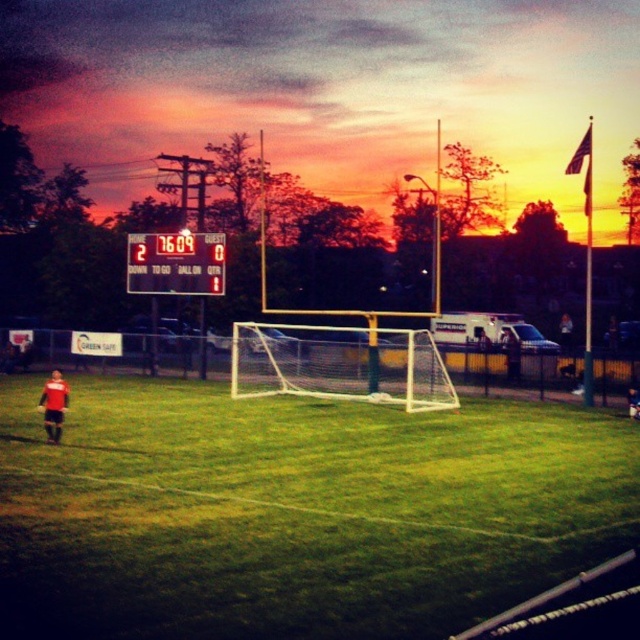
Question: Does black plastic scoreboard at center have a greater width compared to red jersey at lower left?

Choices:
 (A) no
 (B) yes

Answer: (A)

Question: Does green grass soccer field at center have a smaller size compared to black plastic scoreboard at center?

Choices:
 (A) yes
 (B) no

Answer: (B)

Question: Can you confirm if black plastic scoreboard at center is bigger than red jersey at lower left?

Choices:
 (A) yes
 (B) no

Answer: (B)

Question: Which point appears closest to the camera in this image?

Choices:
 (A) (566, 346)
 (B) (224, 253)
 (C) (132, 422)

Answer: (C)

Question: Which of these objects is positioned closest to the red jersey at lower left?

Choices:
 (A) black plastic scoreboard at center
 (B) green grass soccer field at center
 (C) matte black soccer player at center

Answer: (B)

Question: Which object appears farthest from the camera in this image?

Choices:
 (A) matte black soccer player at center
 (B) green grass soccer field at center

Answer: (A)